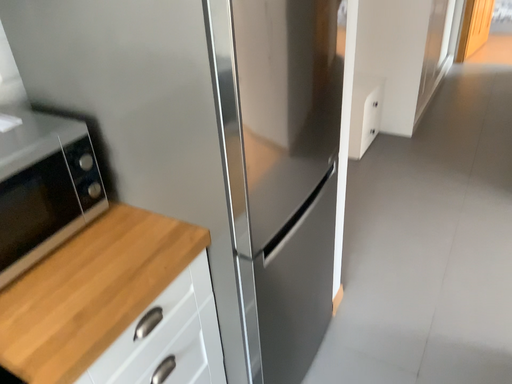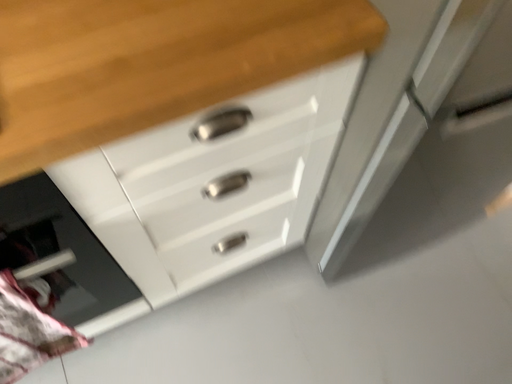
Question: Which way did the camera rotate in the video?

Choices:
 (A) rotated downward
 (B) rotated upward

Answer: (A)